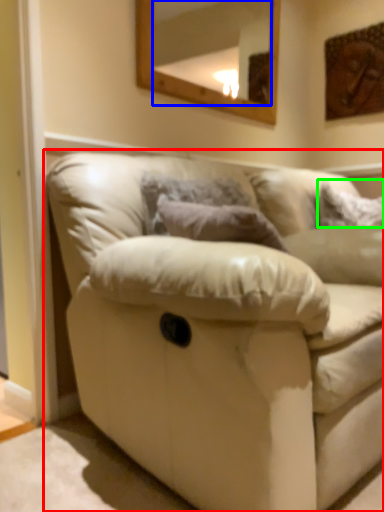
Question: Which is farther away from studio couch (highlighted by a red box)? mirror (highlighted by a blue box) or pillow (highlighted by a green box)?

Choices:
 (A) mirror
 (B) pillow

Answer: (A)